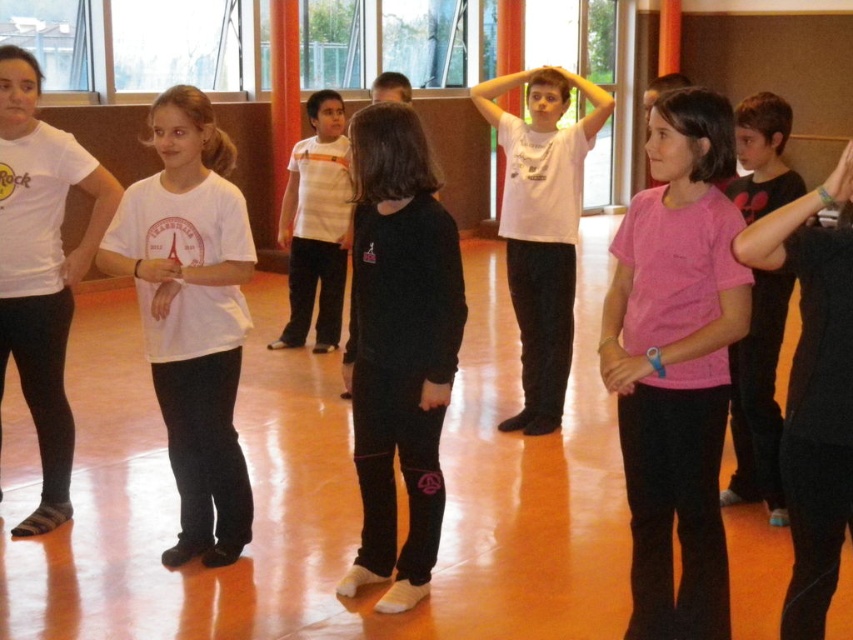
You are a photographer positioned at the origin point of the room. You want to capture a shot where the black matte pants at center is in the foreground. Based on its coordinates, is it closer to the front or back wall of the room?

The black matte pants at center is located at point (399,348), which places it closer to the front wall since the coordinates are closer to the origin point.

You are a photographer positioned at the center of the room. You need to take a photo of the black matte shirt at right and the white matte shirt at center. Given that your camera has a maximum focus range of 4 meters, will both subjects be in focus?

The distance between the black matte shirt at right and the white matte shirt at center is 3.99 meters, which is within the camera maximum focus range of 4 meters. Therefore, both subjects will be in focus.